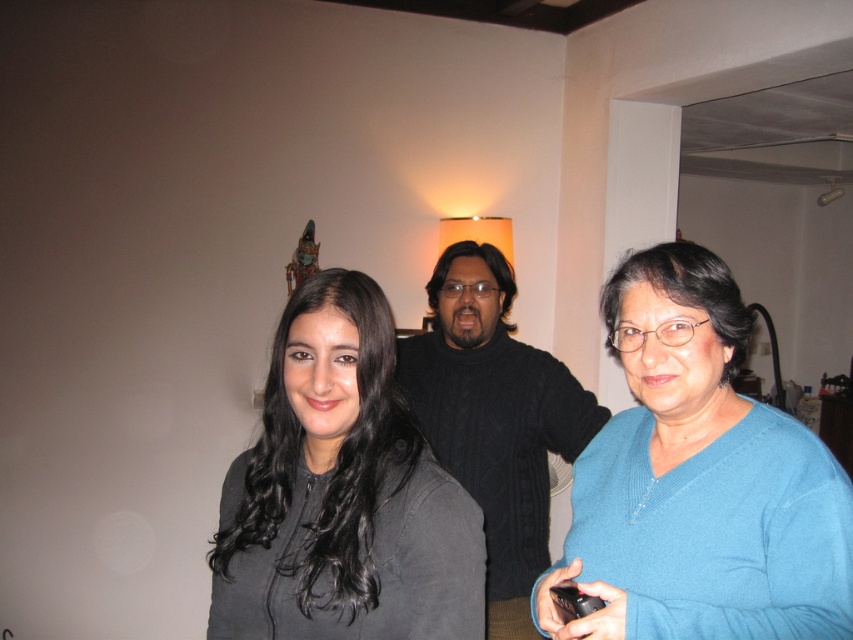
Question: Is blue sweater at center closer to the viewer compared to black cable-knit sweater at center?

Choices:
 (A) no
 (B) yes

Answer: (B)

Question: Which point is closer to the camera taking this photo?

Choices:
 (A) (245, 552)
 (B) (573, 412)
 (C) (718, 420)

Answer: (A)

Question: Among these points, which one is nearest to the camera?

Choices:
 (A) (544, 515)
 (B) (236, 600)
 (C) (685, 419)

Answer: (B)

Question: Which object is farther from the camera taking this photo?

Choices:
 (A) matte gray sweater at center
 (B) blue sweater at center

Answer: (A)

Question: Can you confirm if blue sweater at center is positioned to the right of black cable-knit sweater at center?

Choices:
 (A) no
 (B) yes

Answer: (B)

Question: Is blue sweater at center positioned before black cable-knit sweater at center?

Choices:
 (A) no
 (B) yes

Answer: (B)